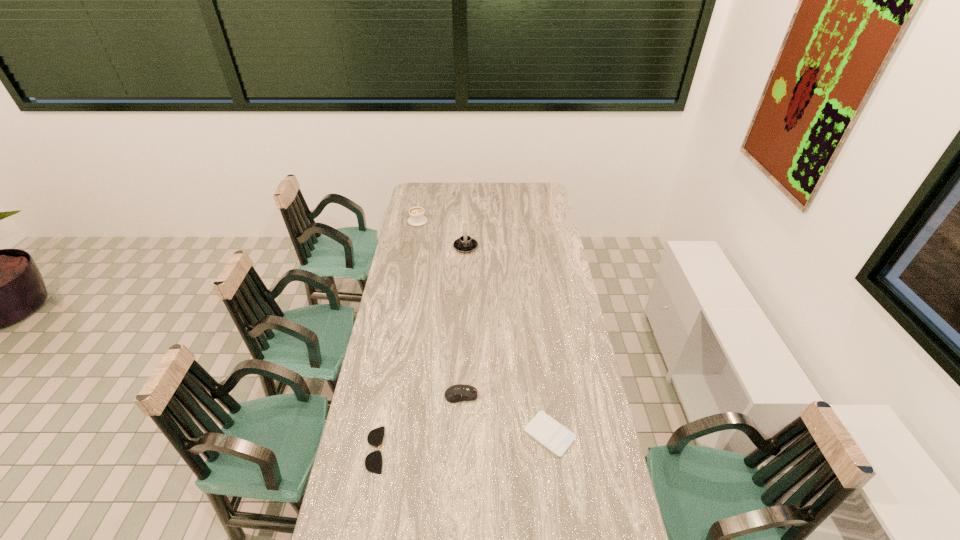
Image resolution: width=960 pixels, height=540 pixels. In order to click on free space between the third nearest object and the spectacles in this screenshot , I will do `click(419, 422)`.

The image size is (960, 540). Identify the location of free area in between the third tallest object and the spectacles. (419, 422).

Identify the location of free space between the spectacles and the rightmost object. This screenshot has height=540, width=960. (463, 442).

Locate an element on the screen. Image resolution: width=960 pixels, height=540 pixels. blank region between the second farthest object and the calculator is located at coordinates (508, 341).

Locate an element on the screen. The image size is (960, 540). blank region between the cappuccino and the second farthest object is located at coordinates (442, 234).

Identify the location of object that can be found as the closest to the farthest object. The width and height of the screenshot is (960, 540). (465, 244).

Locate which object is the closest to the cappuccino. Please provide its 2D coordinates. Your answer should be formatted as a tuple, i.e. [(x, y)], where the tuple contains the x and y coordinates of a point satisfying the conditions above.

[(465, 244)]

I want to click on vacant position in the image that satisfies the following two spatial constraints: 1. on the button of the calculator; 2. on the right side of the computer equipment, so click(x=460, y=434).

I want to click on free space that satisfies the following two spatial constraints: 1. on the button of the calculator; 2. on the right side of the computer equipment, so click(x=460, y=434).

I want to click on vacant position in the image that satisfies the following two spatial constraints: 1. on the button of the rightmost object; 2. on the right side of the computer equipment, so (x=460, y=434).